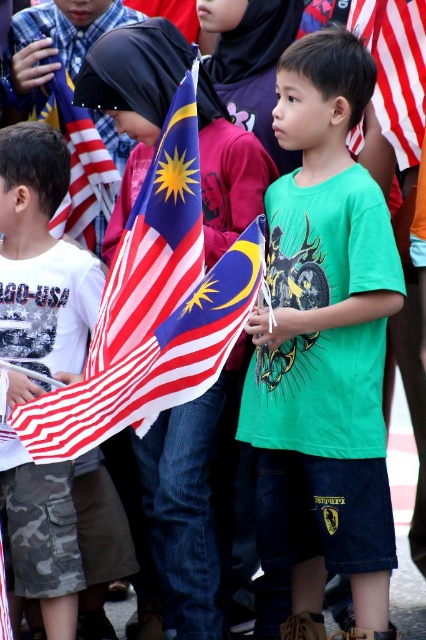
Describe the element at coordinates (40, 256) in the screenshot. This screenshot has width=426, height=640. I see `white camouflage pants at left` at that location.

Can you confirm if white camouflage pants at left is taller than red-white striped flag at upper right?

Indeed, white camouflage pants at left has a greater height compared to red-white striped flag at upper right.

Is point (13, 224) closer to camera compared to point (397, 74)?

Yes, point (13, 224) is closer to viewer.

Find the location of a particular element. The width and height of the screenshot is (426, 640). white camouflage pants at left is located at coordinates tap(40, 256).

Can you confirm if white camouflage pants at left is taller than red-white striped flag at upper left?

Yes, white camouflage pants at left is taller than red-white striped flag at upper left.

The width and height of the screenshot is (426, 640). Identify the location of white camouflage pants at left. (40, 256).

Can you confirm if red-white striped fabric flag at center is shorter than red-white striped flag at upper right?

Correct, red-white striped fabric flag at center is not as tall as red-white striped flag at upper right.

Is point (94, 394) positioned after point (420, 20)?

No, (94, 394) is closer to viewer.

Between point (210, 280) and point (397, 80), which one is positioned behind?

The point (397, 80) is behind.

At what (x,y) coordinates should I click in order to perform the action: click on red-white striped fabric flag at center. Please return your answer as a coordinate pair (x, y). This screenshot has height=640, width=426. Looking at the image, I should click on (152, 362).